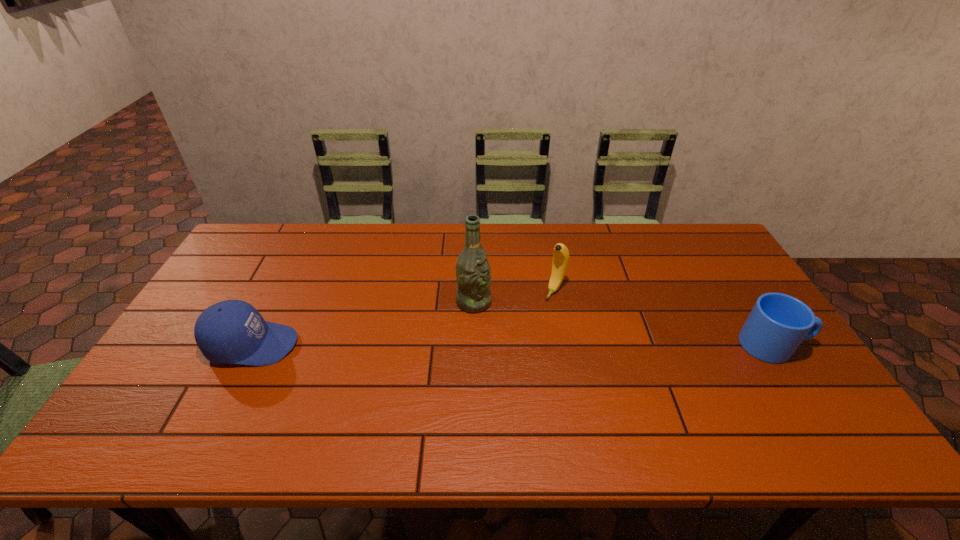
The width and height of the screenshot is (960, 540). Find the location of `free space located on the surface of the beer bottle`. free space located on the surface of the beer bottle is located at coordinates (585, 351).

Locate an element on the screen. The image size is (960, 540). free spot located 0.250m on the surface of the beer bottle is located at coordinates (567, 343).

Where is `free space located on the surface of the beer bottle`? Image resolution: width=960 pixels, height=540 pixels. free space located on the surface of the beer bottle is located at coordinates (591, 354).

In order to click on object at the left edge in this screenshot , I will do `click(232, 331)`.

At what (x,y) coordinates should I click in order to perform the action: click on object at the right edge. Please return your answer as a coordinate pair (x, y). This screenshot has height=540, width=960. Looking at the image, I should click on (778, 323).

This screenshot has width=960, height=540. What are the coordinates of `vacant area at the far edge` in the screenshot? It's located at (372, 237).

In order to click on free spot at the near edge of the desktop in this screenshot , I will do `click(272, 393)`.

Find the location of a particular element. The image size is (960, 540). free location at the right edge of the desktop is located at coordinates (735, 277).

You are a GUI agent. You are given a task and a screenshot of the screen. Output one action in this format:
    pyautogui.click(x=<x>, y=<y>)
    Task: Click on the free space at the far left corner
    The width and height of the screenshot is (960, 540).
    Given the screenshot: What is the action you would take?
    pyautogui.click(x=270, y=246)

Locate an element on the screen. The width and height of the screenshot is (960, 540). free space at the near left corner is located at coordinates (180, 385).